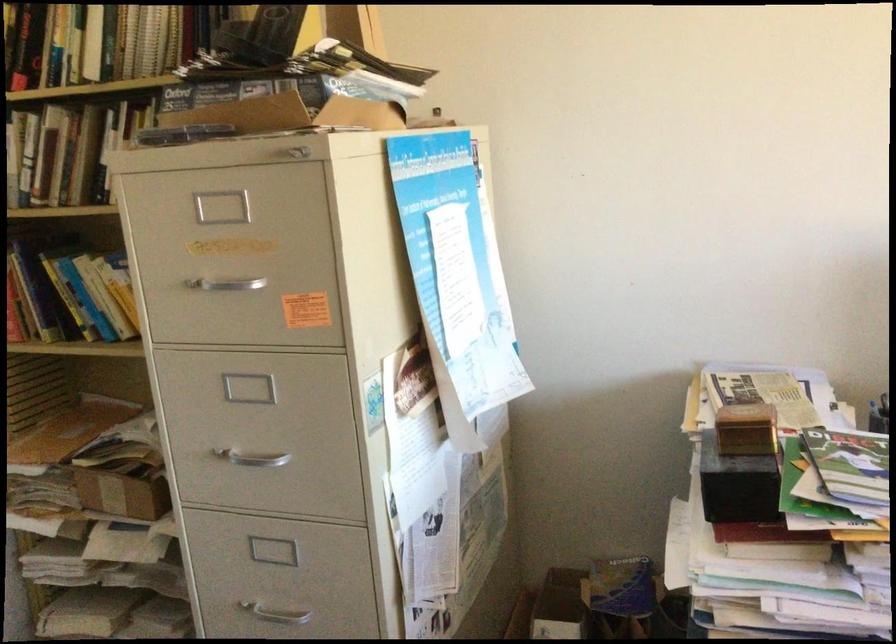
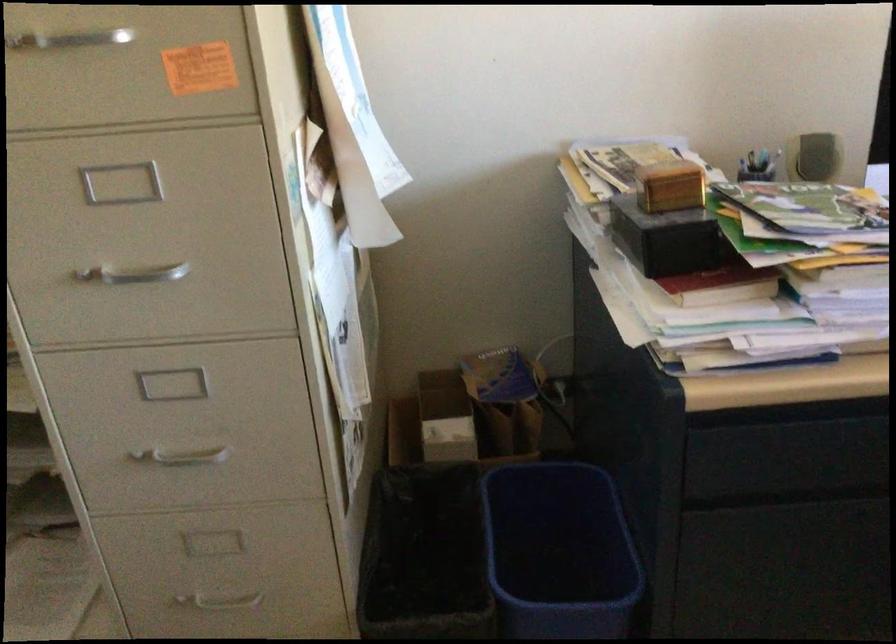
Question: The camera is either moving clockwise (left) or counter-clockwise (right) around the object. The first image is from the beginning of the video and the second image is from the end. Is the camera moving left or right when shooting the video?

Choices:
 (A) Left
 (B) Right

Answer: (A)